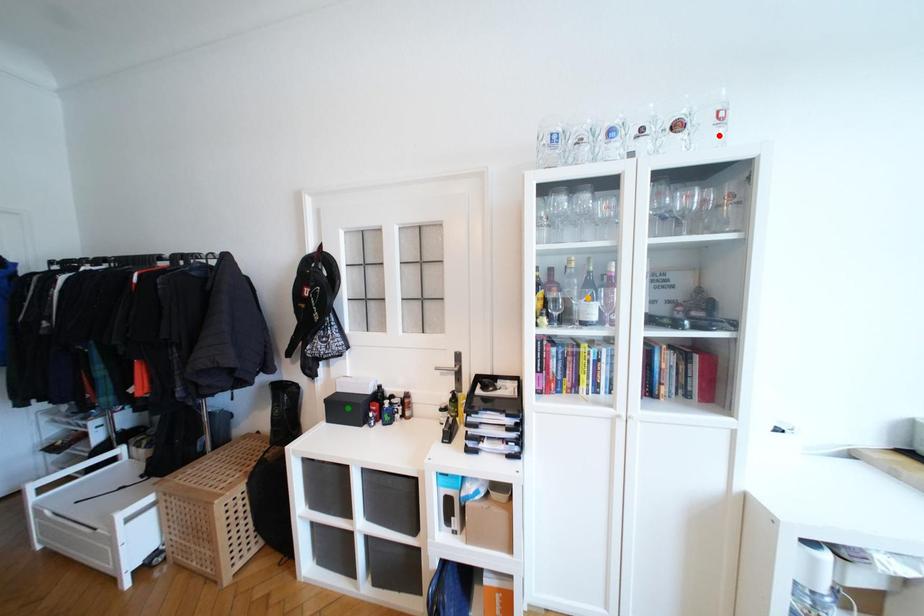
Order these from nearest to farthest:
1. orange point
2. red point
3. green point

1. red point
2. orange point
3. green point